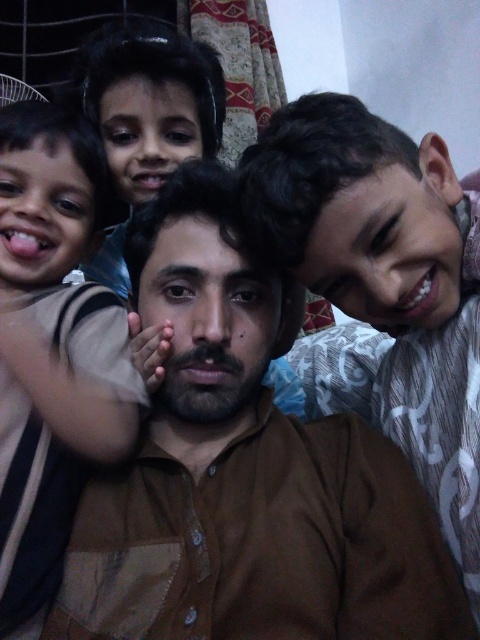
You are a photographer trying to capture a family photo. You notice the brown cotton shirt at center and the brown striped shirt at left. Which one is closer to the camera?

The brown cotton shirt at center is closer to the camera because it is in front of the brown striped shirt at left.

You are a tailor who needs to determine which shirt requires more fabric to make between the brown cotton shirt at center and the brown striped shirt at left. Based on the image, which one would you choose?

The brown cotton shirt at center is larger in size than the brown striped shirt at left, so it would require more fabric to make.